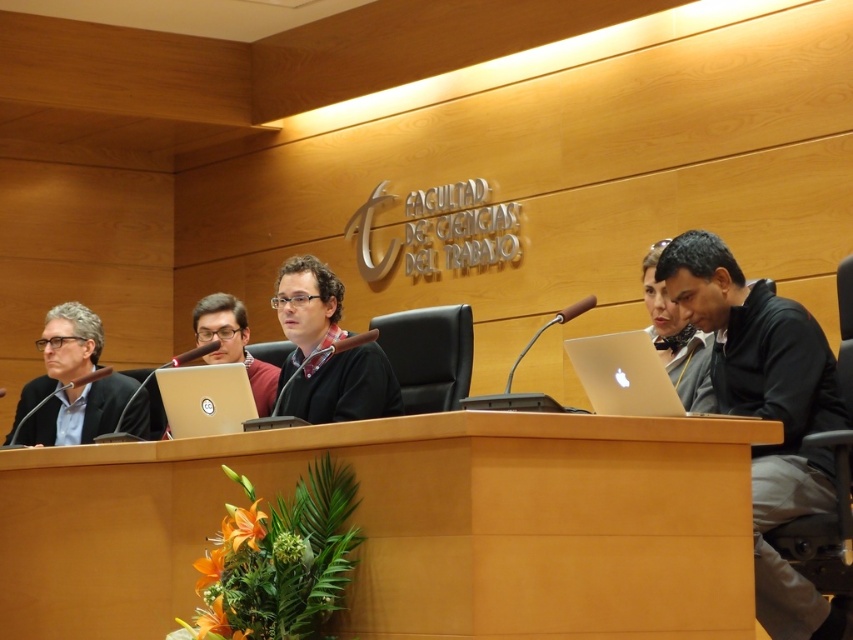
You are attending a conference and need to present a document to the person in the matte black suit at left. The wooden table at center is between you and them. Can you directly hand the document to them without moving around the table?

The wooden table at center is positioned on the right side of matte black suit at left. Since the table is to the right of the person, you can approach from their left side to hand the document directly without needing to go around the table.

What is located at the coordinates point (x=624, y=374)?

A silver metallic laptop at right is located at point (x=624, y=374).